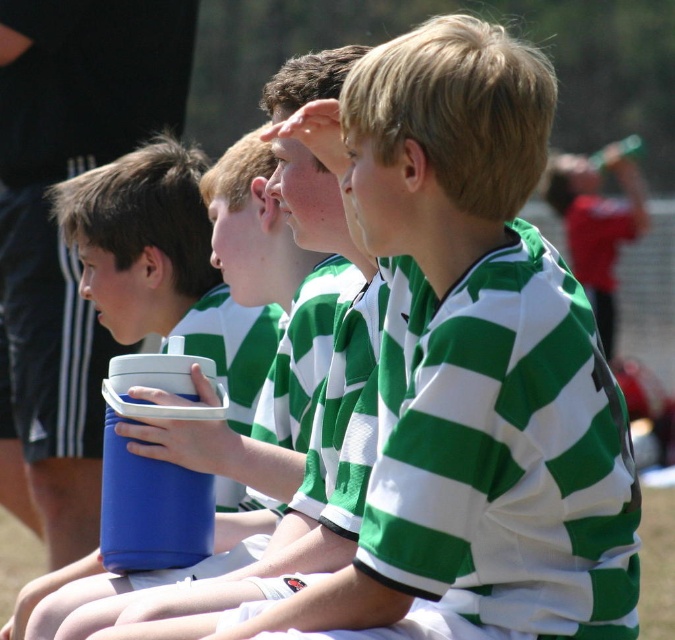
Question: Does blue plastic thermos at center appear on the right side of blue plastic cooler at center?

Choices:
 (A) no
 (B) yes

Answer: (A)

Question: Which object is closer to the camera taking this photo?

Choices:
 (A) blue plastic cooler at center
 (B) blue plastic thermos at center

Answer: (A)

Question: Which of the following is the farthest from the observer?

Choices:
 (A) blue plastic thermos at center
 (B) blue plastic cooler at center

Answer: (A)

Question: Is blue plastic thermos at center thinner than blue plastic cooler at center?

Choices:
 (A) no
 (B) yes

Answer: (A)

Question: Can you confirm if blue plastic thermos at center is smaller than blue plastic cooler at center?

Choices:
 (A) yes
 (B) no

Answer: (B)